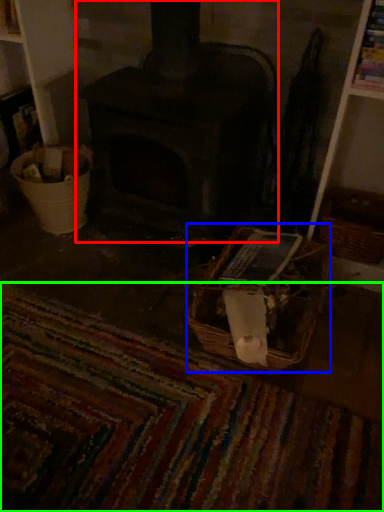
Question: Considering the real-world distances, which object is farthest from wood burning stove (highlighted by a red box)? basket (highlighted by a blue box) or mat (highlighted by a green box)?

Choices:
 (A) basket
 (B) mat

Answer: (B)